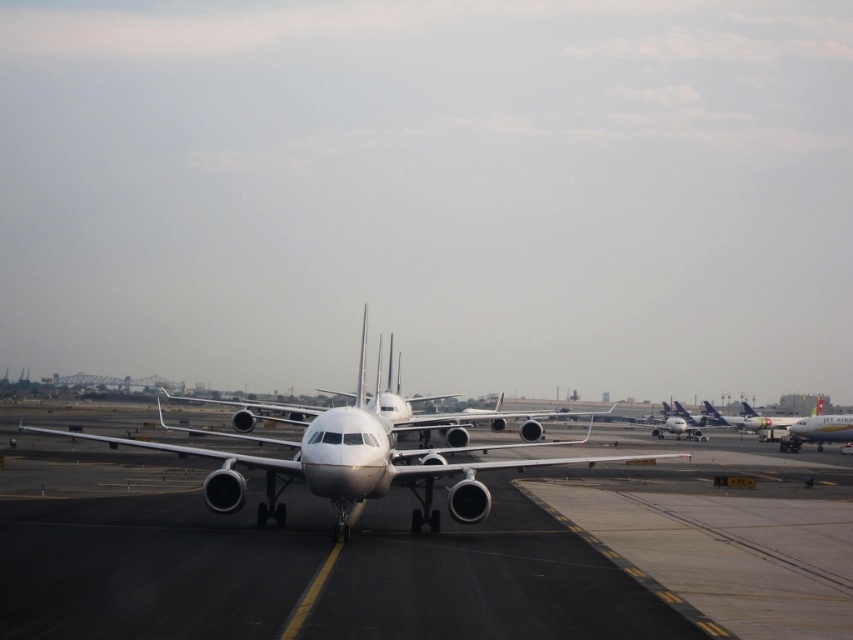
Which is in front, point (4, 429) or point (486, 464)?

Point (486, 464) is in front.

In the scene shown: Who is more distant from viewer, (582, 573) or (485, 449)?

Point (485, 449)

Who is more distant from viewer, (242, 556) or (380, 355)?

Point (380, 355)

Identify the location of white glossy tarmac at center. (428, 554).

Which is above, white glossy tarmac at center or white glossy airplane at right?

white glossy tarmac at center

Based on the photo, does white glossy tarmac at center lie behind white glossy airplane at right?

No, white glossy tarmac at center is closer to the viewer.

What do you see at coordinates (428, 554) in the screenshot?
I see `white glossy tarmac at center` at bounding box center [428, 554].

This screenshot has height=640, width=853. Identify the location of white glossy tarmac at center. (428, 554).

Looking at this image, does white matte airplane at center have a lesser width compared to white glossy airplane at right?

No.

Is white matte airplane at center bigger than white glossy airplane at right?

Correct, white matte airplane at center is larger in size than white glossy airplane at right.

The image size is (853, 640). Identify the location of white matte airplane at center. (344, 465).